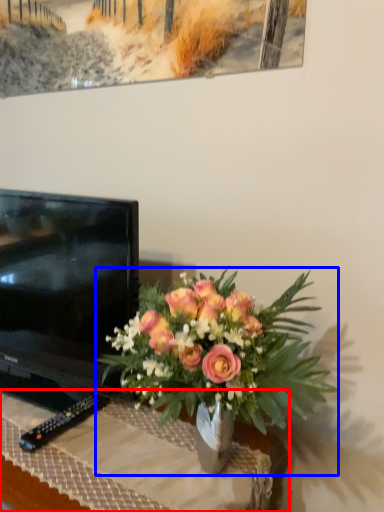
Question: Which point is further to the camera, desk (highlighted by a red box) or houseplant (highlighted by a blue box)?

Choices:
 (A) desk
 (B) houseplant

Answer: (A)